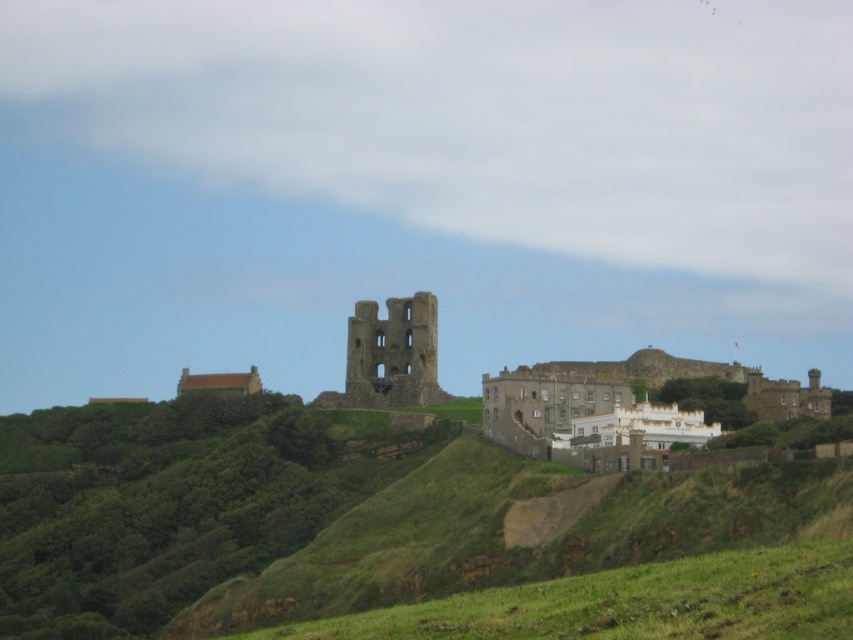
Which is in front, point (573, 570) or point (432, 342)?

Point (573, 570) is more forward.

Measure the distance between point (347,506) and camera.

146.47 meters

Find the location of a particular element. The width and height of the screenshot is (853, 640). green grassy hillside at center is located at coordinates (328, 515).

Does green grassy hillside at center have a lesser height compared to green grassy hillside at lower center?

Incorrect, green grassy hillside at center's height does not fall short of green grassy hillside at lower center's.

Identify the location of green grassy hillside at center. The height and width of the screenshot is (640, 853). (328, 515).

The width and height of the screenshot is (853, 640). What are the coordinates of `green grassy hillside at center` in the screenshot? It's located at (328, 515).

Consider the image. Does green grassy hillside at lower center have a lesser height compared to brown stone castle at center?

No, green grassy hillside at lower center is not shorter than brown stone castle at center.

Is point (837, 588) closer to camera compared to point (431, 355)?

Yes, point (837, 588) is in front of point (431, 355).

Image resolution: width=853 pixels, height=640 pixels. I want to click on green grassy hillside at lower center, so click(x=631, y=604).